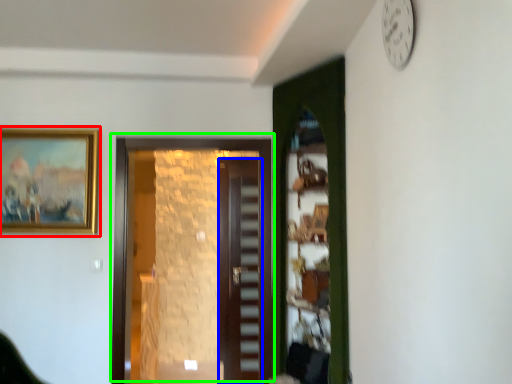
Question: Which object is positioned closest to picture frame (highlighted by a red box)? Select from door (highlighted by a blue box) and door (highlighted by a green box).

Choices:
 (A) door
 (B) door

Answer: (B)